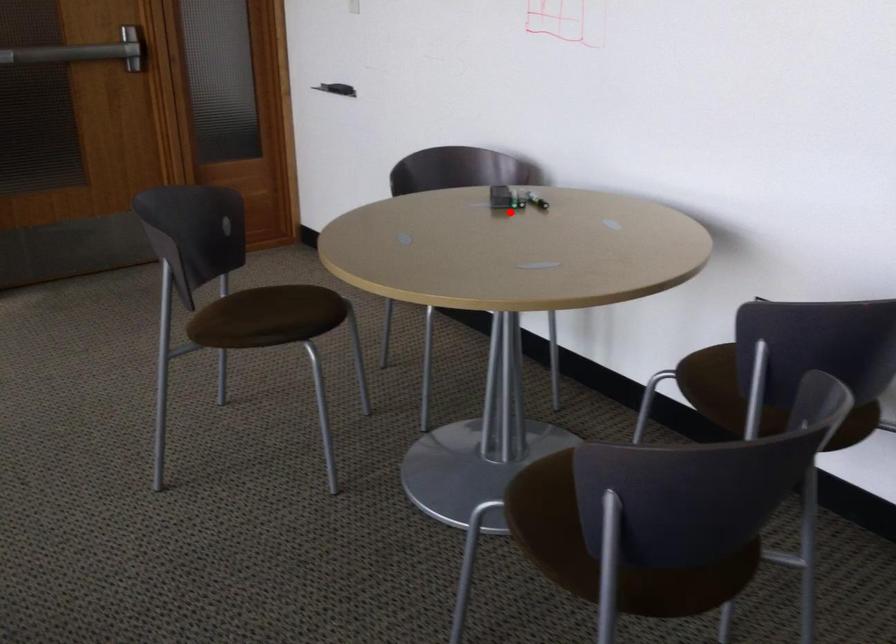
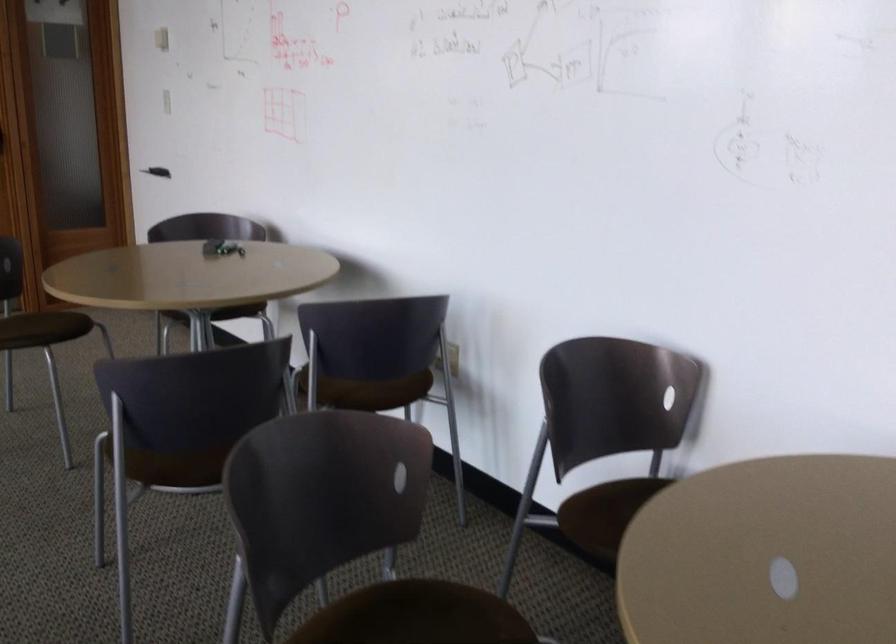
Question: I am providing you with two images of the same scene from different viewpoints. Image1 has a red point marked. In image2, the corresponding 3D location appears at what relative position? Reply with the corresponding letter.

Choices:
 (A) Closer
 (B) Farther

Answer: (B)